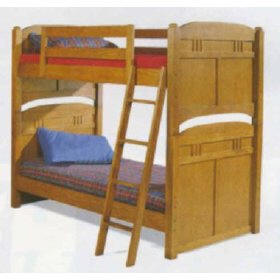
Locate an element on the screen. The width and height of the screenshot is (280, 280). lower foot board is located at coordinates (205, 217).